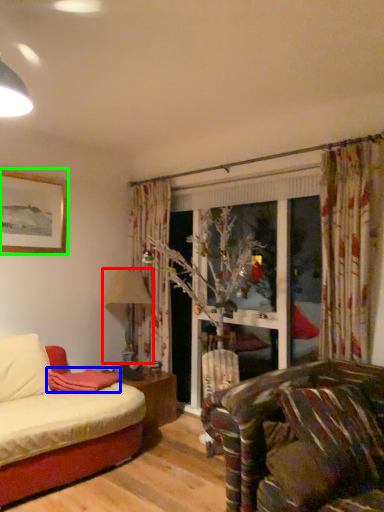
Question: Which object is positioned closest to lamp (highlighted by a red box)? Select from blanket (highlighted by a blue box) and picture frame (highlighted by a green box).

Choices:
 (A) blanket
 (B) picture frame

Answer: (A)